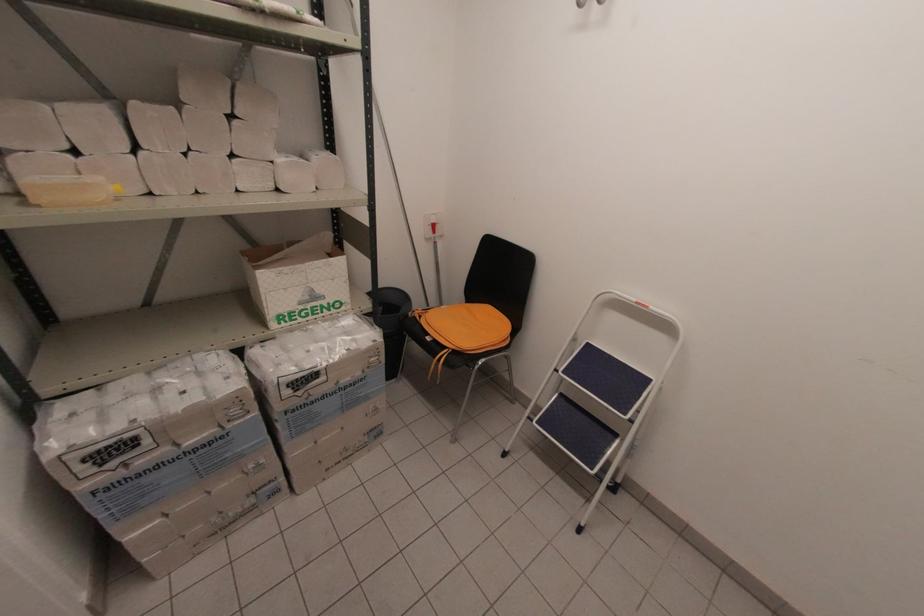
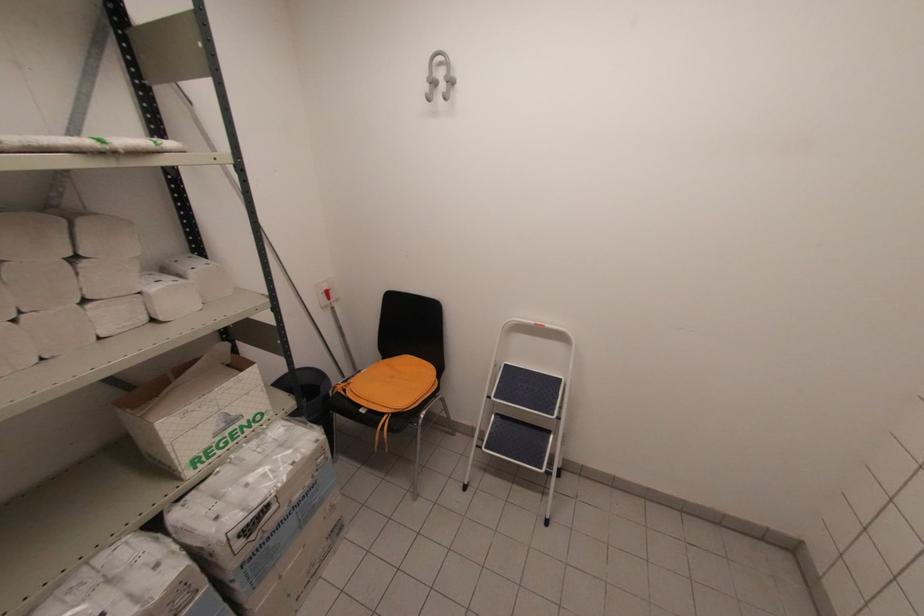
Find the pixel in the second image that matches point (312, 403) in the first image.

(271, 539)